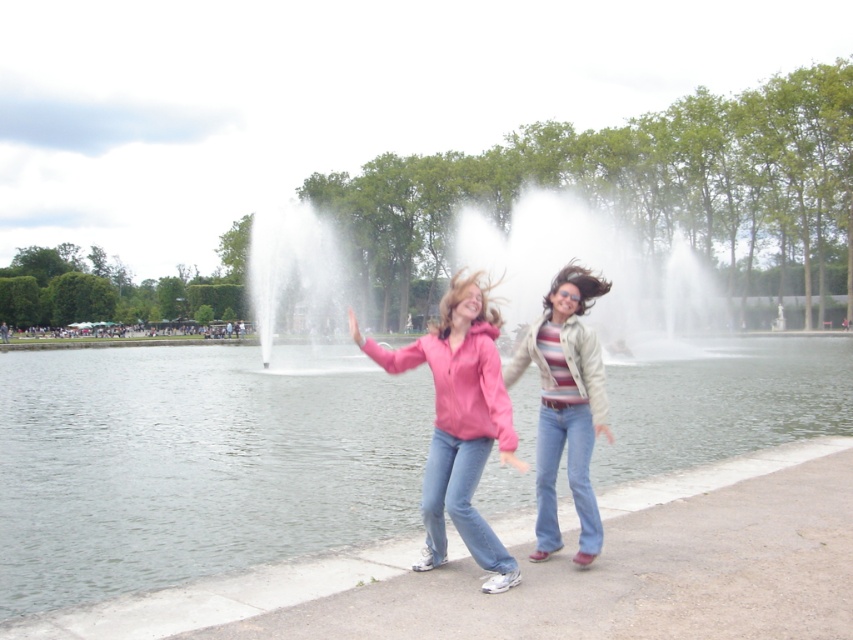
Which of these two, clear water at center or striped knit sweater at center, stands shorter?

Standing shorter between the two is clear water at center.

Based on the photo, can you confirm if clear water at center is smaller than striped knit sweater at center?

No.

Who is more distant from viewer, (x=724, y=362) or (x=554, y=468)?

Positioned behind is point (x=724, y=362).

Locate an element on the screen. Image resolution: width=853 pixels, height=640 pixels. clear water at center is located at coordinates (194, 464).

What do you see at coordinates (589, 266) in the screenshot? I see `white water at center` at bounding box center [589, 266].

Does white water at center appear on the left side of pink matte jacket at center?

Correct, you'll find white water at center to the left of pink matte jacket at center.

Which is behind, point (627, 300) or point (451, 312)?

Point (627, 300)

In order to click on white water at center in this screenshot , I will do `click(589, 266)`.

Is point (265, 348) positioned behind point (579, 326)?

Yes, it is behind point (579, 326).

Does white water at center appear on the left side of striped knit sweater at center?

Yes, white water at center is to the left of striped knit sweater at center.

Who is more forward, (349, 294) or (570, 356)?

Point (570, 356) is more forward.

Identify the location of white water at center. (589, 266).